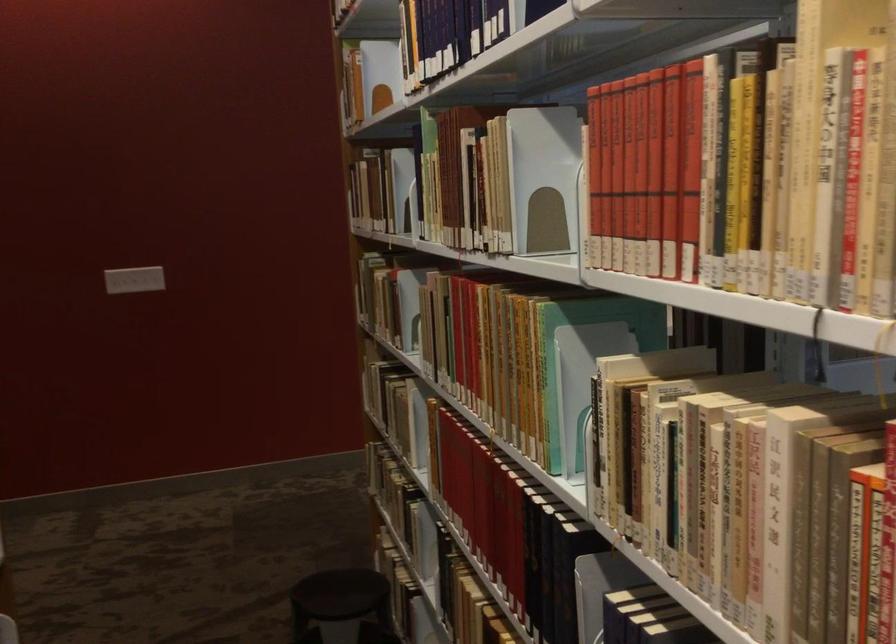
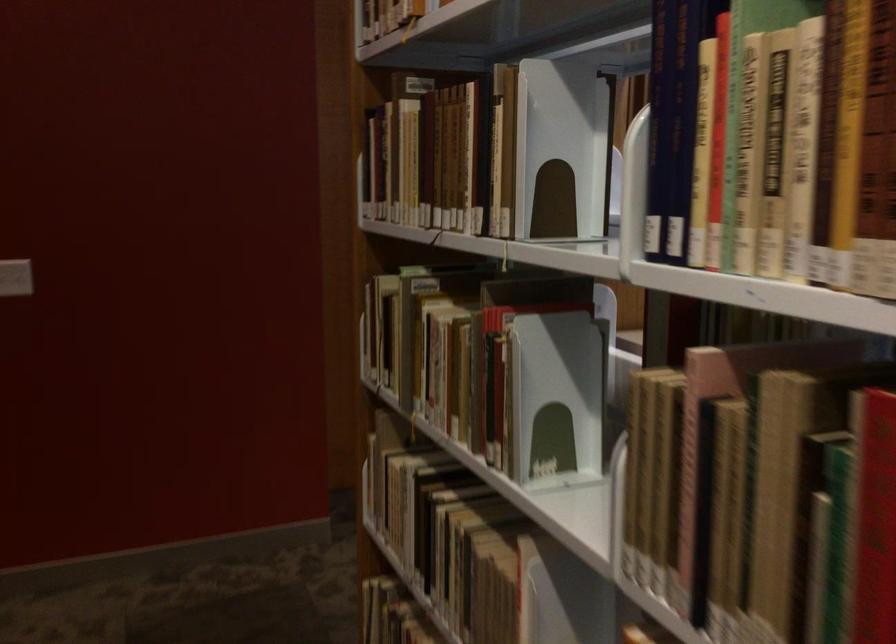
Locate, in the second image, the point that corresponds to point (388, 283) in the first image.

(484, 342)